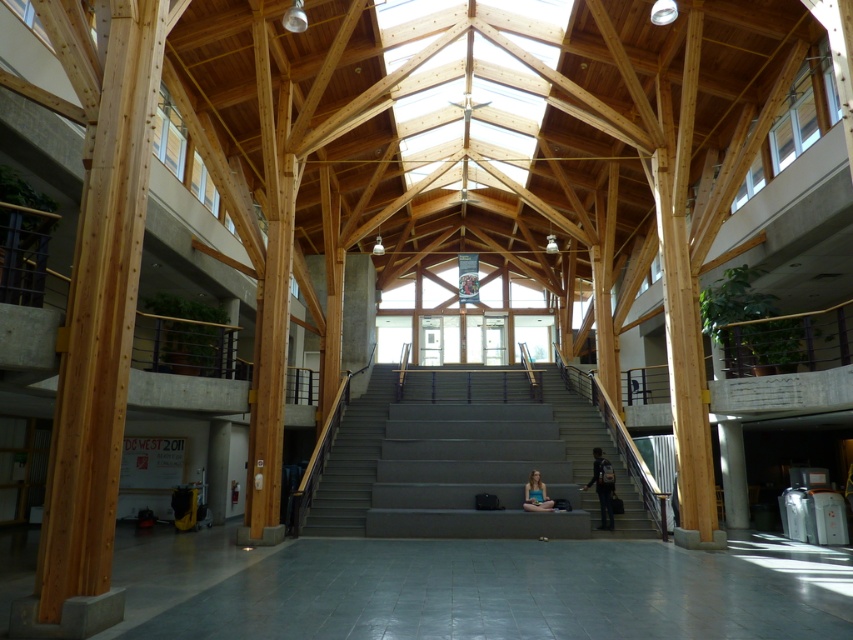
Question: Can you confirm if gray tile floor at lower center is thinner than dark blue backpack at center?

Choices:
 (A) no
 (B) yes

Answer: (A)

Question: Is dark blue backpack at center thinner than matte blue shirt at center?

Choices:
 (A) yes
 (B) no

Answer: (A)

Question: Does gray tile floor at lower center appear over dark blue backpack at center?

Choices:
 (A) yes
 (B) no

Answer: (B)

Question: Which object appears farthest from the camera in this image?

Choices:
 (A) matte blue shirt at center
 (B) gray concrete stairs at center
 (C) dark blue backpack at center

Answer: (C)

Question: Which point appears closest to the camera in this image?

Choices:
 (A) (524, 497)
 (B) (660, 636)
 (C) (587, 484)
 (D) (437, 392)

Answer: (B)

Question: Which object is farther from the camera taking this photo?

Choices:
 (A) dark blue backpack at center
 (B) gray tile floor at lower center
 (C) gray concrete stairs at center

Answer: (A)